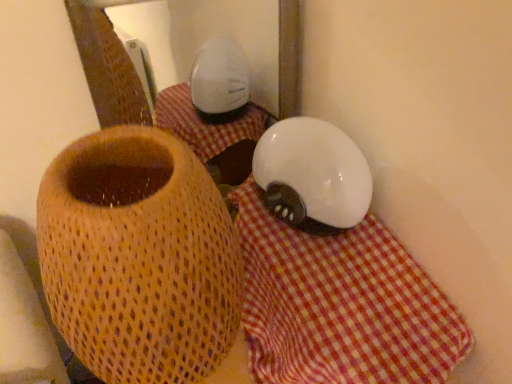
Question: Based on their sizes in the image, would you say matte woven vase at center is bigger or smaller than white checkered cloth at center?

Choices:
 (A) small
 (B) big

Answer: (B)

Question: From a real-world perspective, relative to white checkered cloth at center, is matte woven vase at center vertically above or below?

Choices:
 (A) above
 (B) below

Answer: (A)

Question: Considering their positions, is matte woven vase at center located in front of or behind white checkered cloth at center?

Choices:
 (A) behind
 (B) front

Answer: (B)

Question: Considering the positions of white checkered cloth at center and matte woven vase at center in the image, is white checkered cloth at center bigger or smaller than matte woven vase at center?

Choices:
 (A) big
 (B) small

Answer: (B)

Question: Choose the correct answer: Is white checkered cloth at center inside matte woven vase at center or outside it?

Choices:
 (A) outside
 (B) inside

Answer: (A)

Question: From a real-world perspective, is white checkered cloth at center positioned above or below matte woven vase at center?

Choices:
 (A) below
 (B) above

Answer: (A)

Question: In the image, is white checkered cloth at center on the left side or the right side of matte woven vase at center?

Choices:
 (A) left
 (B) right

Answer: (B)